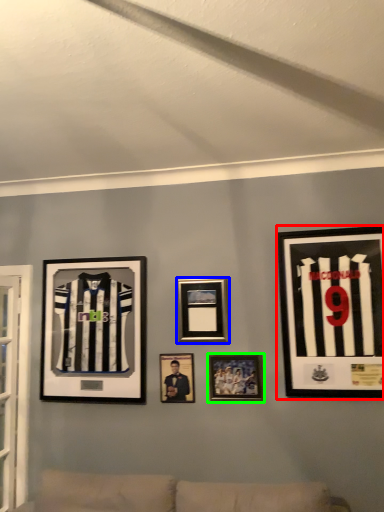
Question: Considering the real-world distances, which object is farthest from picture frame (highlighted by a red box)? picture frame (highlighted by a blue box) or picture frame (highlighted by a green box)?

Choices:
 (A) picture frame
 (B) picture frame

Answer: (A)